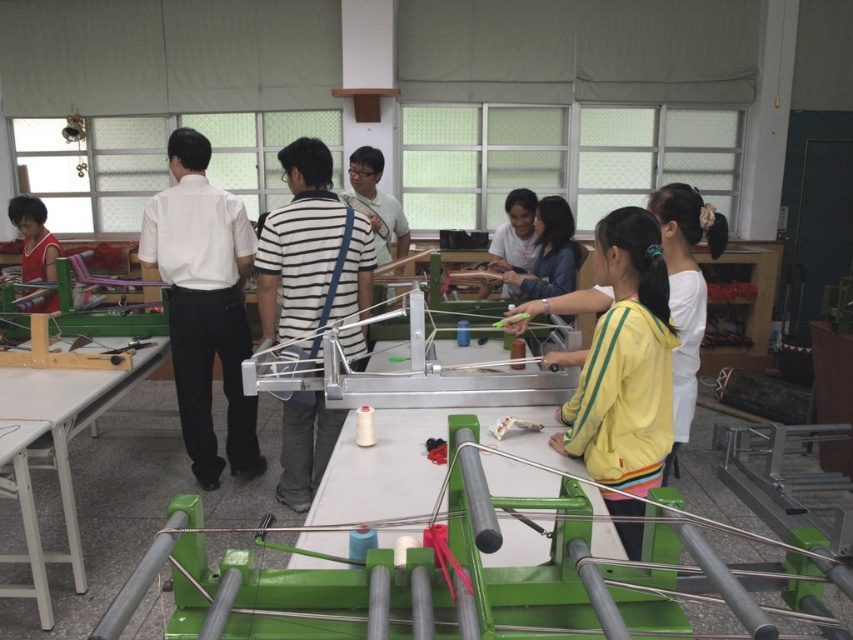
Does white shirt at center appear on the right side of matte red shirt at left?

Correct, you'll find white shirt at center to the right of matte red shirt at left.

Can you confirm if white shirt at center is bigger than matte red shirt at left?

Yes.

Is point (192, 189) more distant than point (44, 253)?

No, (192, 189) is in front of (44, 253).

Locate an element on the screen. white shirt at center is located at coordinates (204, 305).

Does white striped shirt at center have a greater height compared to matte red shirt at left?

Yes, white striped shirt at center is taller than matte red shirt at left.

Measure the distance between white striped shirt at center and matte red shirt at left.

5.17 feet

The image size is (853, 640). I want to click on white striped shirt at center, so click(x=311, y=252).

Which is more to the left, white shirt at center or white striped shirt at center?

From the viewer's perspective, white shirt at center appears more on the left side.

Based on the photo, can you confirm if white shirt at center is thinner than white striped shirt at center?

Yes, white shirt at center is thinner than white striped shirt at center.

Who is more forward, (187, 236) or (291, 209)?

Point (291, 209) is in front.

What are the coordinates of `white shirt at center` in the screenshot? It's located at (204, 305).